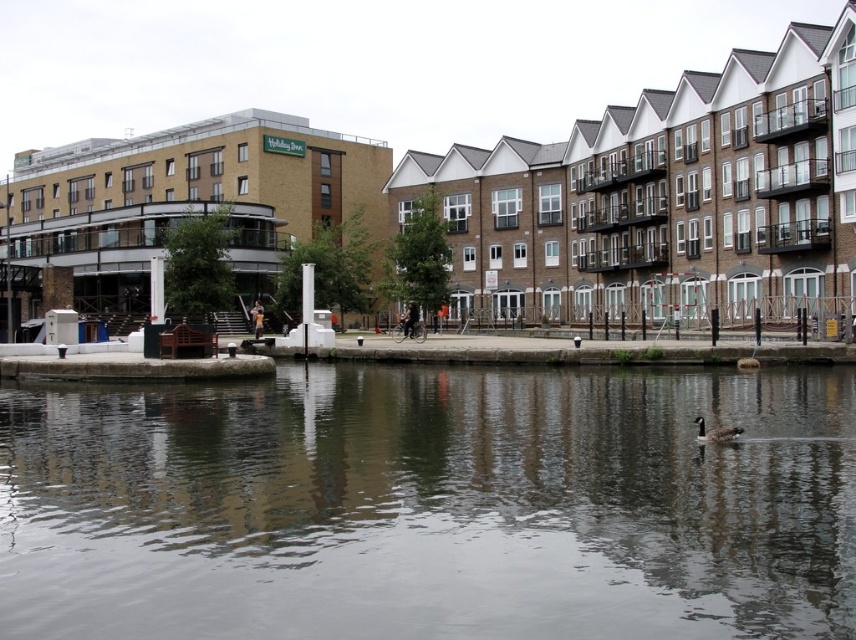
Question: Which point is farther from the camera taking this photo?

Choices:
 (A) click(x=712, y=433)
 (B) click(x=617, y=582)

Answer: (A)

Question: Does smooth concrete water at center appear on the left side of brown matte duck at lower center?

Choices:
 (A) yes
 (B) no

Answer: (A)

Question: Which point appears closest to the camera in this image?

Choices:
 (A) (37, 608)
 (B) (698, 440)

Answer: (A)

Question: Is smooth concrete water at center smaller than brown matte duck at lower center?

Choices:
 (A) yes
 (B) no

Answer: (B)

Question: Is smooth concrete water at center bigger than brown matte duck at lower center?

Choices:
 (A) yes
 (B) no

Answer: (A)